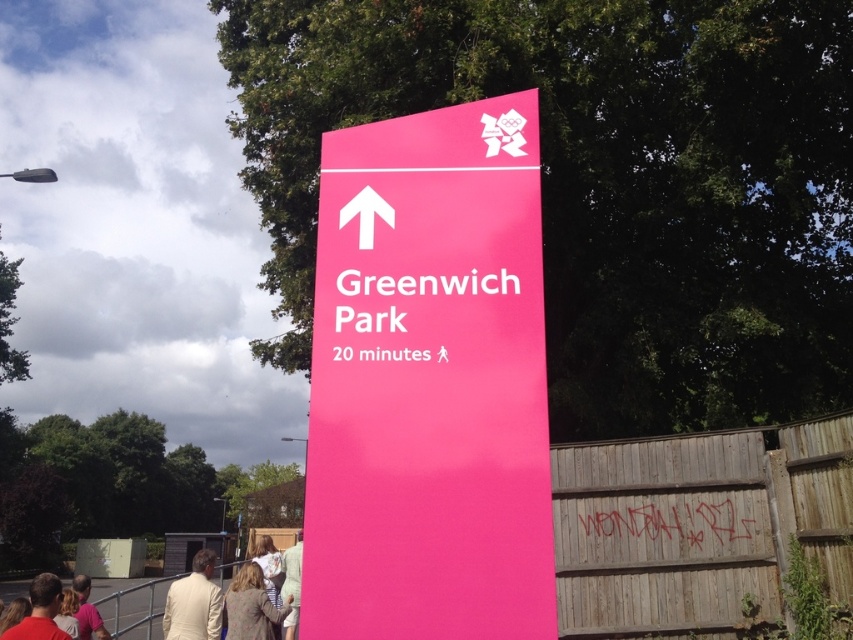
You are standing in front of the matte pink sign at center and the light brown textured coat at lower center. Which object is larger in size?

The light brown textured coat at lower center is larger in size compared to the matte pink sign at center.